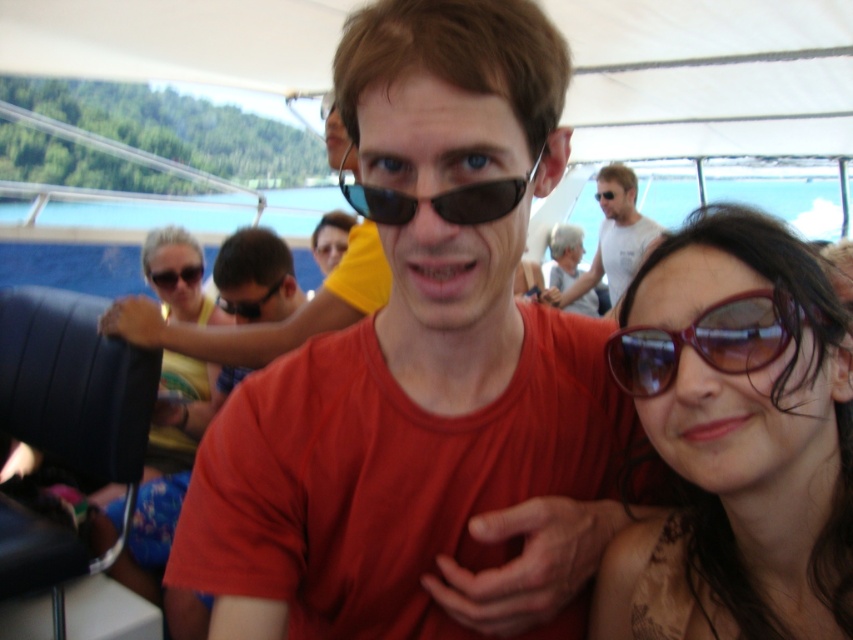
Question: Does brown reflective sunglasses at center have a greater width compared to shiny brown sunglasses at right?

Choices:
 (A) yes
 (B) no

Answer: (A)

Question: Among these points, which one is nearest to the camera?

Choices:
 (A) (386, 180)
 (B) (608, 257)

Answer: (A)

Question: Which of the following is the closest to the observer?

Choices:
 (A) matte orange t-shirt at center
 (B) shiny brown sunglasses at right
 (C) matte black sunglasses at center

Answer: (A)

Question: Is brown reflective sunglasses at center smaller than sunglasses at center?

Choices:
 (A) no
 (B) yes

Answer: (A)

Question: Which point is farther from the camera taking this photo?

Choices:
 (A) (160, 288)
 (B) (613, 376)
 (C) (178, 456)

Answer: (A)

Question: Does matte black sunglasses at center appear on the right side of black plastic goggles at center?

Choices:
 (A) no
 (B) yes

Answer: (B)